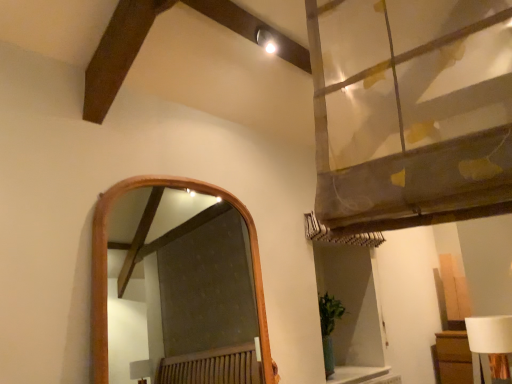
The height and width of the screenshot is (384, 512). What do you see at coordinates (490, 340) in the screenshot?
I see `white glossy table lamp at lower right` at bounding box center [490, 340].

You are a GUI agent. You are given a task and a screenshot of the screen. Output one action in this format:
    pyautogui.click(x=<x>, y=<y>)
    Task: Click on the white glossy table lamp at lower right
    Image resolution: width=512 pixels, height=384 pixels.
    Given the screenshot: What is the action you would take?
    pyautogui.click(x=490, y=340)

This screenshot has width=512, height=384. What are the coordinates of `white glossy table lamp at lower right` in the screenshot? It's located at (490, 340).